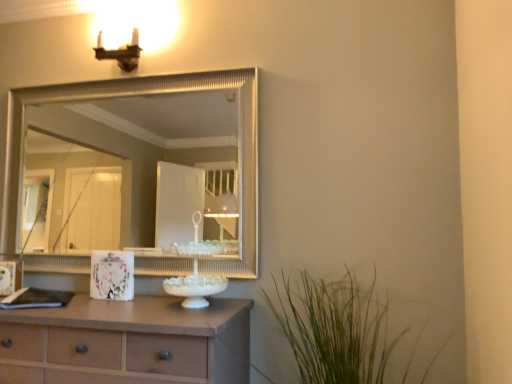
Question: Is matte brown sconce at upper left not close to silver textured mirror at upper center?

Choices:
 (A) yes
 (B) no

Answer: (A)

Question: From the image's perspective, is matte brown sconce at upper left beneath silver textured mirror at upper center?

Choices:
 (A) no
 (B) yes

Answer: (A)

Question: From the image's perspective, is matte brown sconce at upper left on top of silver textured mirror at upper center?

Choices:
 (A) yes
 (B) no

Answer: (A)

Question: From a real-world perspective, is matte brown sconce at upper left beneath silver textured mirror at upper center?

Choices:
 (A) no
 (B) yes

Answer: (A)

Question: Considering the relative sizes of matte brown sconce at upper left and silver textured mirror at upper center in the image provided, is matte brown sconce at upper left thinner than silver textured mirror at upper center?

Choices:
 (A) no
 (B) yes

Answer: (B)

Question: Is silver textured mirror at upper center located within matte brown sconce at upper left?

Choices:
 (A) no
 (B) yes

Answer: (A)

Question: Does green grass at lower right have a lesser width compared to matte brown chest of drawers at lower left?

Choices:
 (A) no
 (B) yes

Answer: (A)

Question: Is green grass at lower right positioned before matte brown chest of drawers at lower left?

Choices:
 (A) yes
 (B) no

Answer: (A)

Question: Are green grass at lower right and matte brown chest of drawers at lower left beside each other?

Choices:
 (A) no
 (B) yes

Answer: (A)

Question: Is green grass at lower right shorter than matte brown chest of drawers at lower left?

Choices:
 (A) yes
 (B) no

Answer: (B)

Question: From the image's perspective, would you say green grass at lower right is positioned over matte brown chest of drawers at lower left?

Choices:
 (A) no
 (B) yes

Answer: (B)

Question: Is green grass at lower right located outside matte brown chest of drawers at lower left?

Choices:
 (A) yes
 (B) no

Answer: (A)

Question: Is matte brown chest of drawers at lower left located outside silver textured mirror at upper center?

Choices:
 (A) yes
 (B) no

Answer: (A)